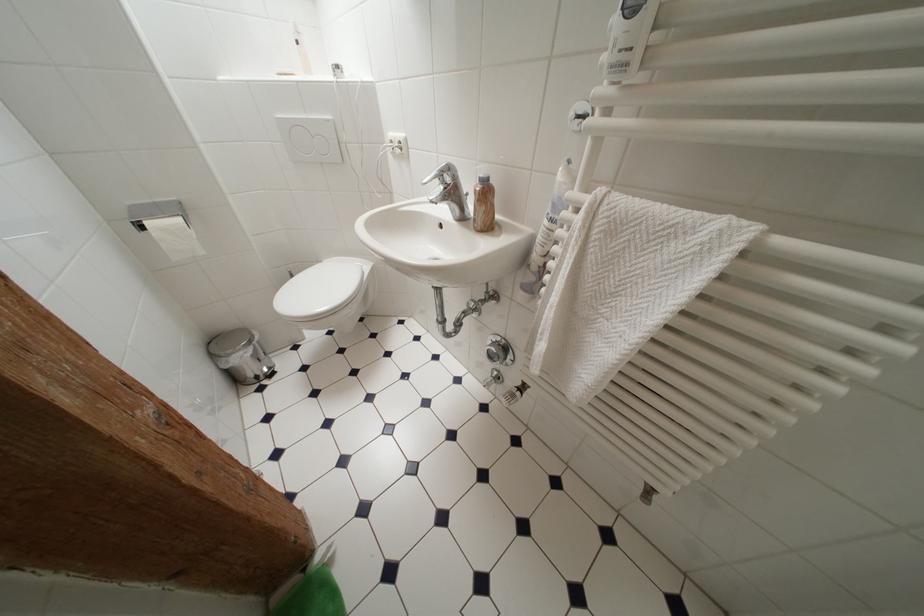
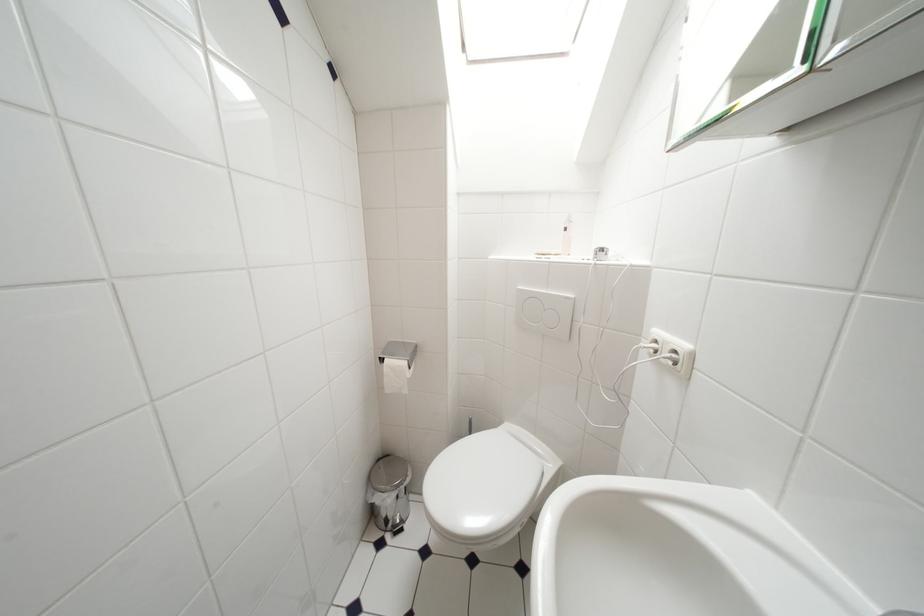
Question: The camera is either moving clockwise (left) or counter-clockwise (right) around the object. The first image is from the beginning of the video and the second image is from the end. Is the camera moving left or right when shooting the video?

Choices:
 (A) Left
 (B) Right

Answer: (B)